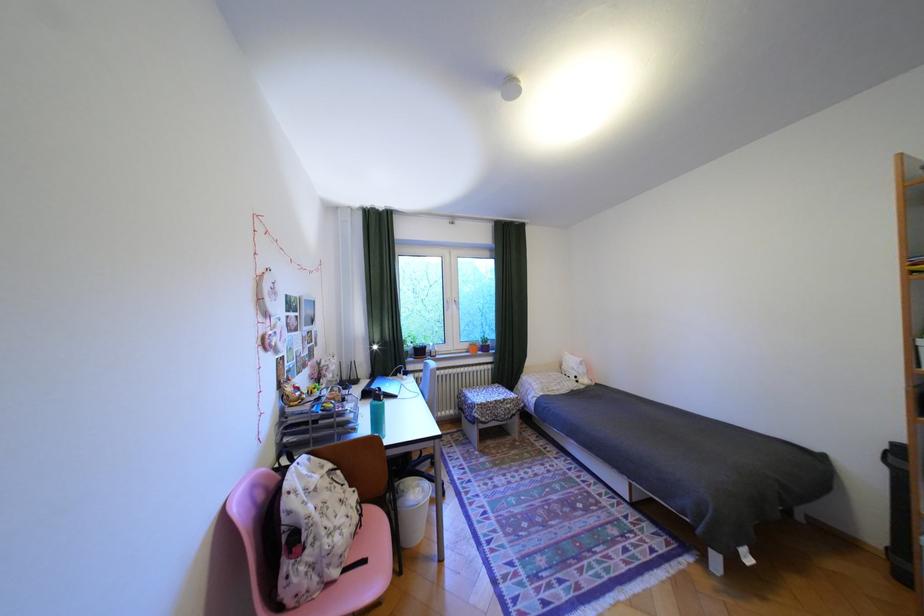
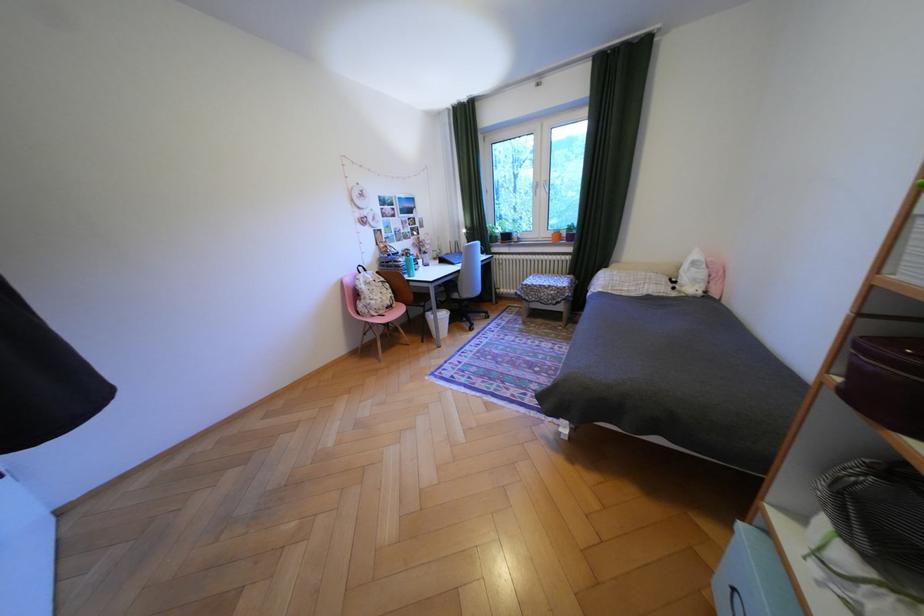
Locate, in the second image, the point that corresponds to point 338,495 in the first image.

(386, 288)